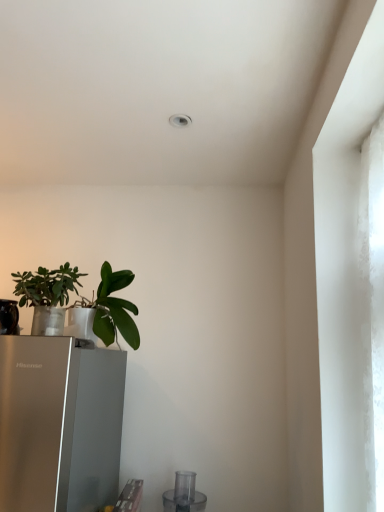
What do you see at coordinates (184, 494) in the screenshot? The height and width of the screenshot is (512, 384). I see `transparent plastic blender at lower center` at bounding box center [184, 494].

The height and width of the screenshot is (512, 384). What do you see at coordinates (47, 296) in the screenshot? I see `green matte plant at left, the first houseplant when ordered from left to right` at bounding box center [47, 296].

In order to face green matte leafy plant at lower left, which is the 2th houseplant in left-to-right order, should I rotate leftwards or rightwards?

Turn left by 10.188 degrees to look at green matte leafy plant at lower left, which is the 2th houseplant in left-to-right order.

Where is `transparent plastic blender at lower center`? Image resolution: width=384 pixels, height=512 pixels. transparent plastic blender at lower center is located at coordinates (184, 494).

Is transparent plastic blender at lower center oriented towards green matte leafy plant at lower left, which is counted as the 1th houseplant, starting from the right?

No, transparent plastic blender at lower center is not aimed at green matte leafy plant at lower left, which is counted as the 1th houseplant, starting from the right.

From their relative heights in the image, would you say transparent plastic blender at lower center is taller or shorter than green matte leafy plant at lower left, which is counted as the 1th houseplant, starting from the right?

In the image, transparent plastic blender at lower center appears to be shorter than green matte leafy plant at lower left, which is counted as the 1th houseplant, starting from the right.

From the transparent plastic blender at lower center, count the 1st houseplant to the left and point to it. Please provide its 2D coordinates.

[(112, 308)]

Does transparent plastic blender at lower center touch green matte leafy plant at lower left, which is the 2th houseplant in left-to-right order?

No, transparent plastic blender at lower center is not making contact with green matte leafy plant at lower left, which is the 2th houseplant in left-to-right order.

Does green matte plant at left, the first houseplant when ordered from left to right, appear on the right side of green matte leafy plant at lower left, which is counted as the 1th houseplant, starting from the right?

No, green matte plant at left, the first houseplant when ordered from left to right, is not to the right of green matte leafy plant at lower left, which is counted as the 1th houseplant, starting from the right.

How many degrees apart are the facing directions of green matte plant at left, acting as the 2th houseplant starting from the right, and green matte leafy plant at lower left, which is counted as the 1th houseplant, starting from the right?

The facing directions of green matte plant at left, acting as the 2th houseplant starting from the right, and green matte leafy plant at lower left, which is counted as the 1th houseplant, starting from the right, are 1.22 degrees apart.

From a real-world perspective, is green matte plant at left, the first houseplant when ordered from left to right, positioned above or below green matte leafy plant at lower left, which is the 2th houseplant in left-to-right order?

From a real-world perspective, green matte plant at left, the first houseplant when ordered from left to right, is physically below green matte leafy plant at lower left, which is the 2th houseplant in left-to-right order.

From the image's perspective, which one is positioned lower, green matte plant at left, acting as the 2th houseplant starting from the right, or green matte leafy plant at lower left, which is counted as the 1th houseplant, starting from the right?

green matte leafy plant at lower left, which is counted as the 1th houseplant, starting from the right, appears lower in the image.

Does point (55, 315) come farther from viewer compared to point (194, 481)?

No.

Is green matte plant at left, the first houseplant when ordered from left to right, bigger or smaller than transparent plastic blender at lower center?

green matte plant at left, the first houseplant when ordered from left to right, is bigger than transparent plastic blender at lower center.

Is green matte plant at left, the first houseplant when ordered from left to right, situated inside transparent plastic blender at lower center or outside?

green matte plant at left, the first houseplant when ordered from left to right, is located beyond the bounds of transparent plastic blender at lower center.

In terms of height, does green matte plant at left, the first houseplant when ordered from left to right, look taller or shorter compared to transparent plastic blender at lower center?

In the image, green matte plant at left, the first houseplant when ordered from left to right, appears to be taller than transparent plastic blender at lower center.

Are green matte leafy plant at lower left, which is counted as the 1th houseplant, starting from the right, and green matte plant at left, the first houseplant when ordered from left to right, making contact?

green matte leafy plant at lower left, which is counted as the 1th houseplant, starting from the right, and green matte plant at left, the first houseplant when ordered from left to right, are clearly separated.

Considering the sizes of objects green matte leafy plant at lower left, which is counted as the 1th houseplant, starting from the right, and green matte plant at left, the first houseplant when ordered from left to right, in the image provided, who is thinner, green matte leafy plant at lower left, which is counted as the 1th houseplant, starting from the right, or green matte plant at left, the first houseplant when ordered from left to right,?

green matte leafy plant at lower left, which is counted as the 1th houseplant, starting from the right.

From a real-world perspective, is green matte leafy plant at lower left, which is counted as the 1th houseplant, starting from the right, located higher than green matte plant at left, acting as the 2th houseplant starting from the right?

Yes, from a real-world perspective, green matte leafy plant at lower left, which is counted as the 1th houseplant, starting from the right, is on top of green matte plant at left, acting as the 2th houseplant starting from the right.

Considering the sizes of objects green matte leafy plant at lower left, which is counted as the 1th houseplant, starting from the right, and green matte plant at left, the first houseplant when ordered from left to right, in the image provided, who is shorter, green matte leafy plant at lower left, which is counted as the 1th houseplant, starting from the right, or green matte plant at left, the first houseplant when ordered from left to right,?

With less height is green matte plant at left, the first houseplant when ordered from left to right.

Can you confirm if green matte leafy plant at lower left, which is counted as the 1th houseplant, starting from the right, is shorter than transparent plastic blender at lower center?

Incorrect, the height of green matte leafy plant at lower left, which is counted as the 1th houseplant, starting from the right, does not fall short of that of transparent plastic blender at lower center.

Between green matte leafy plant at lower left, which is the 2th houseplant in left-to-right order, and transparent plastic blender at lower center, which one has smaller size?

With smaller size is transparent plastic blender at lower center.

Is green matte leafy plant at lower left, which is counted as the 1th houseplant, starting from the right, next to transparent plastic blender at lower center?

green matte leafy plant at lower left, which is counted as the 1th houseplant, starting from the right, and transparent plastic blender at lower center are not in contact.

Which is more to the right, green matte leafy plant at lower left, which is counted as the 1th houseplant, starting from the right, or transparent plastic blender at lower center?

Positioned to the right is transparent plastic blender at lower center.

In terms of width, does transparent plastic blender at lower center look wider or thinner when compared to green matte plant at left, acting as the 2th houseplant starting from the right?

In the image, transparent plastic blender at lower center appears to be wider than green matte plant at left, acting as the 2th houseplant starting from the right.

In order to click on appliance on the right of green matte plant at left, acting as the 2th houseplant starting from the right in this screenshot , I will do `click(184, 494)`.

Which is more to the left, transparent plastic blender at lower center or green matte plant at left, the first houseplant when ordered from left to right?

Positioned to the left is green matte plant at left, the first houseplant when ordered from left to right.

Could you measure the distance between transparent plastic blender at lower center and green matte plant at left, acting as the 2th houseplant starting from the right?

transparent plastic blender at lower center is 38.05 inches away from green matte plant at left, acting as the 2th houseplant starting from the right.

Locate an element on the screen. The width and height of the screenshot is (384, 512). appliance behind the green matte leafy plant at lower left, which is the 2th houseplant in left-to-right order is located at coordinates coord(184,494).

You are a GUI agent. You are given a task and a screenshot of the screen. Output one action in this format:
    pyautogui.click(x=<x>, y=<y>)
    Task: Click on the houseplant that appears in front of the green matte leafy plant at lower left, which is counted as the 1th houseplant, starting from the right
    The width and height of the screenshot is (384, 512).
    Given the screenshot: What is the action you would take?
    [x=47, y=296]

Based on their spatial positions, is green matte leafy plant at lower left, which is counted as the 1th houseplant, starting from the right, or green matte plant at left, the first houseplant when ordered from left to right, further from transparent plastic blender at lower center?

Among the two, green matte plant at left, the first houseplant when ordered from left to right, is located further to transparent plastic blender at lower center.

When comparing their distances from transparent plastic blender at lower center, does green matte plant at left, the first houseplant when ordered from left to right, or green matte leafy plant at lower left, which is counted as the 1th houseplant, starting from the right, seem further?

The object further to transparent plastic blender at lower center is green matte plant at left, the first houseplant when ordered from left to right.

When comparing their distances from green matte plant at left, acting as the 2th houseplant starting from the right, does transparent plastic blender at lower center or green matte leafy plant at lower left, which is counted as the 1th houseplant, starting from the right, seem further?

The object further to green matte plant at left, acting as the 2th houseplant starting from the right, is transparent plastic blender at lower center.

Estimate the real-world distances between objects in this image. Which object is closer to green matte plant at left, acting as the 2th houseplant starting from the right, green matte leafy plant at lower left, which is the 2th houseplant in left-to-right order, or transparent plastic blender at lower center?

green matte leafy plant at lower left, which is the 2th houseplant in left-to-right order.

Which object lies nearer to the anchor point green matte leafy plant at lower left, which is counted as the 1th houseplant, starting from the right, transparent plastic blender at lower center or green matte plant at left, the first houseplant when ordered from left to right?

Based on the image, green matte plant at left, the first houseplant when ordered from left to right, appears to be nearer to green matte leafy plant at lower left, which is counted as the 1th houseplant, starting from the right.

When comparing their distances from green matte leafy plant at lower left, which is the 2th houseplant in left-to-right order, does green matte plant at left, the first houseplant when ordered from left to right, or transparent plastic blender at lower center seem further?

transparent plastic blender at lower center is further to green matte leafy plant at lower left, which is the 2th houseplant in left-to-right order.

This screenshot has width=384, height=512. What are the coordinates of `houseplant that lies between green matte plant at left, the first houseplant when ordered from left to right, and transparent plastic blender at lower center from top to bottom` in the screenshot? It's located at (112, 308).